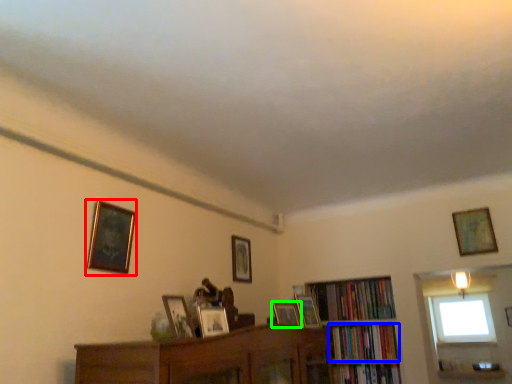
Question: Which object is positioned farthest from picture frame (highlighted by a red box)? Select from book (highlighted by a blue box) and picture frame (highlighted by a green box).

Choices:
 (A) book
 (B) picture frame

Answer: (A)